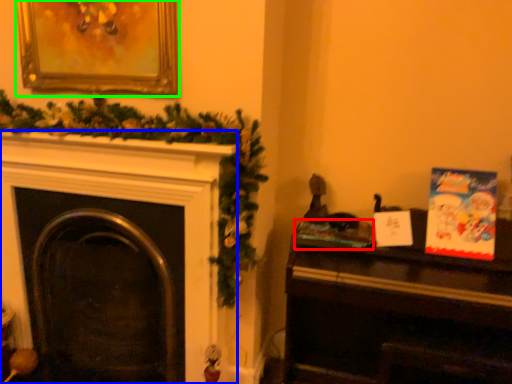
Question: Which object is the farthest from book (highlighted by a red box)? Choose among these: fireplace (highlighted by a blue box) or picture frame (highlighted by a green box).

Choices:
 (A) fireplace
 (B) picture frame

Answer: (B)